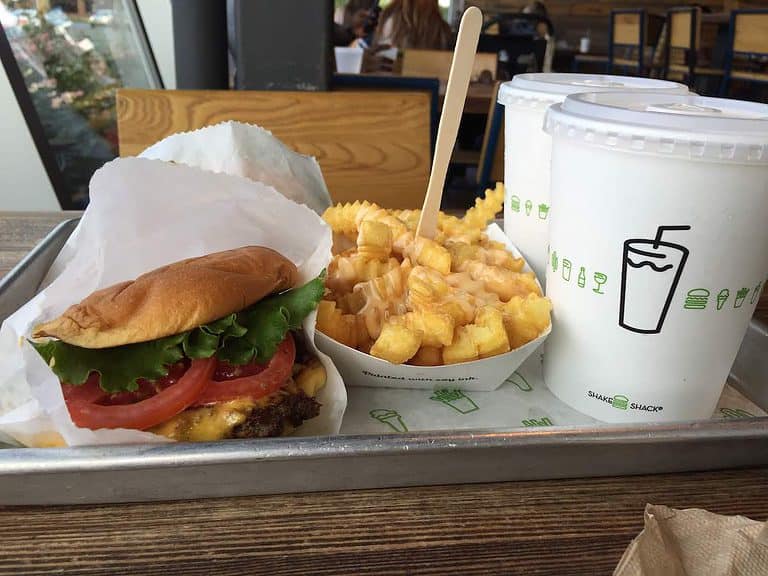
This screenshot has height=576, width=768. Identify the location of table. (25, 229).